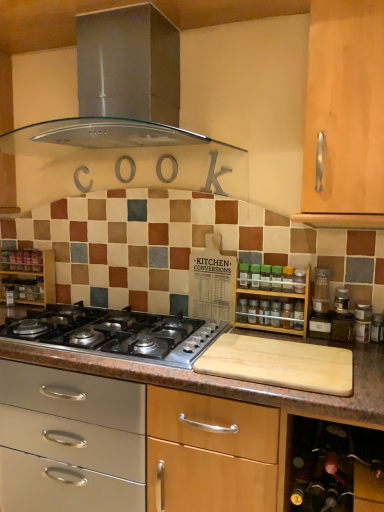
Question: From the image's perspective, is wooden shelf at left, which ranks as the 2th shelf in front-to-back order, over stainless steel range hood at upper center?

Choices:
 (A) yes
 (B) no

Answer: (B)

Question: Is the depth of wooden shelf at left, arranged as the 1th shelf when viewed from the left, greater than that of stainless steel range hood at upper center?

Choices:
 (A) no
 (B) yes

Answer: (B)

Question: Is wooden shelf at left, which ranks as the 2th shelf in front-to-back order, shorter than stainless steel range hood at upper center?

Choices:
 (A) no
 (B) yes

Answer: (B)

Question: Is wooden shelf at left, the 2th shelf in the right-to-left sequence, outside of stainless steel range hood at upper center?

Choices:
 (A) no
 (B) yes

Answer: (B)

Question: Does wooden shelf at left, arranged as the 1th shelf when viewed from the left, have a larger size compared to stainless steel range hood at upper center?

Choices:
 (A) yes
 (B) no

Answer: (B)

Question: Would you consider wooden shelf at left, arranged as the 1th shelf when viewed from the left, to be distant from stainless steel range hood at upper center?

Choices:
 (A) yes
 (B) no

Answer: (B)

Question: Does transparent glass spice at center, positioned as the second bottle in top-to-bottom order, have a greater height compared to stainless steel range hood at upper center?

Choices:
 (A) no
 (B) yes

Answer: (A)

Question: Is transparent glass spice at center, the first bottle from the left, positioned with its back to stainless steel range hood at upper center?

Choices:
 (A) yes
 (B) no

Answer: (B)

Question: Is transparent glass spice at center, arranged as the first bottle when viewed from the back, smaller than stainless steel range hood at upper center?

Choices:
 (A) no
 (B) yes

Answer: (B)

Question: Does transparent glass spice at center, the 2th bottle in the right-to-left sequence, have a lesser height compared to stainless steel range hood at upper center?

Choices:
 (A) no
 (B) yes

Answer: (B)

Question: Does transparent glass spice at center, the second bottle when ordered from front to back, appear on the right side of stainless steel range hood at upper center?

Choices:
 (A) yes
 (B) no

Answer: (A)

Question: Would you say transparent glass spice at center, arranged as the first bottle when ordered from the bottom, is outside stainless steel range hood at upper center?

Choices:
 (A) yes
 (B) no

Answer: (A)

Question: Is wooden spice rack at right, placed as the first shelf when sorted from right to left, shorter than transparent glass spice at center, positioned as the second bottle in top-to-bottom order?

Choices:
 (A) yes
 (B) no

Answer: (B)